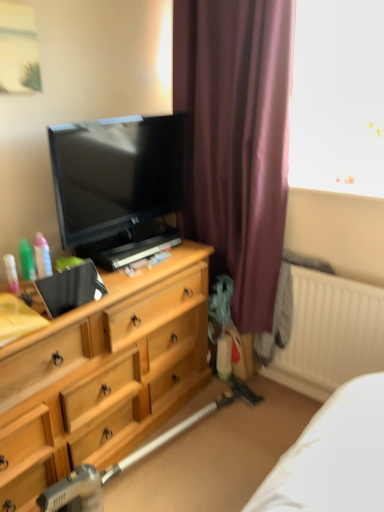
Identify the location of translucent plastic bottles at left, arranged as the 3th toiletry when viewed from the left. Image resolution: width=384 pixels, height=512 pixels. (42, 256).

You are a GUI agent. You are given a task and a screenshot of the screen. Output one action in this format:
    pyautogui.click(x=<x>, y=<y>)
    Task: Click on the matte black tv at left
    This screenshot has width=384, height=512.
    Given the screenshot: What is the action you would take?
    pyautogui.click(x=118, y=185)

Describe the element at coordinates (26, 260) in the screenshot. Image resolution: width=384 pixels, height=512 pixels. I see `translucent plastic bottles at left, which appears as the 2th toiletry when viewed from the left` at that location.

Find the location of a particular element. This screenshot has width=384, height=512. translucent plastic bottles at left, arranged as the 3th toiletry when viewed from the left is located at coordinates (42, 256).

Which of these two, white ribbed radiator at right or matte black tv at left, is smaller?

matte black tv at left is smaller.

In the scene shown: Which is nearer, (357, 341) or (87, 219)?

The point (87, 219) is closer to the camera.

Would you say white ribbed radiator at right is to the left or to the right of matte black tv at left in the picture?

Clearly, white ribbed radiator at right is on the right of matte black tv at left in the image.

How different are the orientations of white ribbed radiator at right and matte black tv at left in degrees?

89.1 degrees.

Looking at this image, which object is positioned more to the right, translucent plastic bottles at left, which appears as the 2th toiletry when viewed from the left, or matte black tv at left?

matte black tv at left.

Is translucent plastic bottles at left, positioned as the 2th toiletry in right-to-left order, aimed at matte black tv at left?

No, translucent plastic bottles at left, positioned as the 2th toiletry in right-to-left order, is not aimed at matte black tv at left.

Is translucent plastic bottles at left, positioned as the 2th toiletry in right-to-left order, beside matte black tv at left?

No.

From a real-world perspective, between translucent plastic bottles at left, positioned as the 2th toiletry in right-to-left order, and matte black tv at left, who is vertically lower?

From a 3D spatial view, translucent plastic bottles at left, positioned as the 2th toiletry in right-to-left order, is below.

Who is bigger, translucent plastic bottles at left, positioned as the 2th toiletry in right-to-left order, or translucent plastic spray bottle at left, the 3th toiletry when ordered from right to left?

translucent plastic bottles at left, positioned as the 2th toiletry in right-to-left order, is bigger.

Is translucent plastic bottles at left, positioned as the 2th toiletry in right-to-left order, shorter than translucent plastic spray bottle at left, the 3th toiletry when ordered from right to left?

In fact, translucent plastic bottles at left, positioned as the 2th toiletry in right-to-left order, may be taller than translucent plastic spray bottle at left, the 3th toiletry when ordered from right to left.

Does point (28, 247) come behind point (13, 273)?

No, (28, 247) is closer to viewer.

Would you consider translucent plastic bottles at left, which appears as the 2th toiletry when viewed from the left, to be distant from translucent plastic spray bottle at left, the 3th toiletry when ordered from right to left?

No, translucent plastic bottles at left, which appears as the 2th toiletry when viewed from the left, is not far away from translucent plastic spray bottle at left, the 3th toiletry when ordered from right to left.

From the image's perspective, does wooden chest of drawers at left appear higher than translucent plastic spray bottle at left, which is counted as the 1th toiletry, starting from the left?

No, from the image's perspective, wooden chest of drawers at left is not above translucent plastic spray bottle at left, which is counted as the 1th toiletry, starting from the left.

Which object is closer to the camera, wooden chest of drawers at left or translucent plastic spray bottle at left, the 3th toiletry when ordered from right to left?

wooden chest of drawers at left.

Is wooden chest of drawers at left next to translucent plastic spray bottle at left, which is counted as the 1th toiletry, starting from the left?

wooden chest of drawers at left and translucent plastic spray bottle at left, which is counted as the 1th toiletry, starting from the left, are not in contact.

Is wooden chest of drawers at left oriented towards translucent plastic spray bottle at left, the 3th toiletry when ordered from right to left?

No, wooden chest of drawers at left is not aimed at translucent plastic spray bottle at left, the 3th toiletry when ordered from right to left.

Is metallic silver vacuum cleaner at lower center bigger or smaller than purple fabric curtain at center?

Clearly, metallic silver vacuum cleaner at lower center is smaller in size than purple fabric curtain at center.

The width and height of the screenshot is (384, 512). Find the location of `equipment located underneath the purple fabric curtain at center (from a real-world perspective)`. equipment located underneath the purple fabric curtain at center (from a real-world perspective) is located at coordinates (129, 459).

Is metallic silver vacuum cleaner at lower center oriented towards purple fabric curtain at center?

No, metallic silver vacuum cleaner at lower center is not facing towards purple fabric curtain at center.

Looking at this image, which is in front, metallic silver vacuum cleaner at lower center or purple fabric curtain at center?

metallic silver vacuum cleaner at lower center is in front.

Is point (128, 150) positioned before point (43, 242)?

No, it is not.

How much distance is there between matte black tv at left and translucent plastic bottles at left, the first toiletry from the right?

They are 17.00 inches apart.

Based on the photo, from a real-world perspective, is matte black tv at left above or below translucent plastic bottles at left, arranged as the 3th toiletry when viewed from the left?

From a real-world perspective, matte black tv at left is physically above translucent plastic bottles at left, arranged as the 3th toiletry when viewed from the left.

Considering the relative positions of matte black tv at left and translucent plastic bottles at left, arranged as the 3th toiletry when viewed from the left, in the image provided, is matte black tv at left to the left or to the right of translucent plastic bottles at left, arranged as the 3th toiletry when viewed from the left,?

From the image, it's evident that matte black tv at left is to the right of translucent plastic bottles at left, arranged as the 3th toiletry when viewed from the left.

Find the location of a particular element. The image size is (384, 512). chest of drawers below the translucent plastic bottles at left, positioned as the 2th toiletry in right-to-left order (from a real-world perspective) is located at coordinates (103, 374).

Looking at the image, does translucent plastic bottles at left, positioned as the 2th toiletry in right-to-left order, seem bigger or smaller compared to wooden chest of drawers at left?

translucent plastic bottles at left, positioned as the 2th toiletry in right-to-left order, is smaller than wooden chest of drawers at left.

Is translucent plastic bottles at left, which appears as the 2th toiletry when viewed from the left, not inside wooden chest of drawers at left?

Absolutely, translucent plastic bottles at left, which appears as the 2th toiletry when viewed from the left, is external to wooden chest of drawers at left.

From a real-world perspective, is translucent plastic bottles at left, which appears as the 2th toiletry when viewed from the left, physically above wooden chest of drawers at left?

Yes, from a real-world perspective, translucent plastic bottles at left, which appears as the 2th toiletry when viewed from the left, is on top of wooden chest of drawers at left.

I want to click on radiator behind the matte black tv at left, so click(330, 334).

This screenshot has height=512, width=384. Find the location of `television in front of the translucent plastic bottles at left, positioned as the 2th toiletry in right-to-left order`. television in front of the translucent plastic bottles at left, positioned as the 2th toiletry in right-to-left order is located at coordinates (118, 185).

From the image, which object appears to be farther from translucent plastic spray bottle at left, the 3th toiletry when ordered from right to left, matte black tv at left or purple fabric curtain at center?

purple fabric curtain at center is positioned further to the anchor translucent plastic spray bottle at left, the 3th toiletry when ordered from right to left.

In the scene shown: Estimate the real-world distances between objects in this image. Which object is further from translucent plastic spray bottle at left, which is counted as the 1th toiletry, starting from the left, translucent plastic bottles at left, the first toiletry from the right, or metallic silver vacuum cleaner at lower center?

metallic silver vacuum cleaner at lower center is further to translucent plastic spray bottle at left, which is counted as the 1th toiletry, starting from the left.

Estimate the real-world distances between objects in this image. Which object is closer to metallic silver vacuum cleaner at lower center, white ribbed radiator at right or wooden chest of drawers at left?

wooden chest of drawers at left is closer to metallic silver vacuum cleaner at lower center.

From the image, which object appears to be farther from translucent plastic bottles at left, the first toiletry from the right, translucent plastic bottles at left, positioned as the 2th toiletry in right-to-left order, or wooden chest of drawers at left?

wooden chest of drawers at left lies further to translucent plastic bottles at left, the first toiletry from the right, than the other object.

Which object lies further to the anchor point wooden chest of drawers at left, white ribbed radiator at right or translucent plastic bottles at left, arranged as the 3th toiletry when viewed from the left?

white ribbed radiator at right is positioned further to the anchor wooden chest of drawers at left.

Considering their positions, is metallic silver vacuum cleaner at lower center positioned closer to white ribbed radiator at right than translucent plastic bottles at left, arranged as the 3th toiletry when viewed from the left?

Among the two, metallic silver vacuum cleaner at lower center is located nearer to white ribbed radiator at right.

Estimate the real-world distances between objects in this image. Which object is closer to white ribbed radiator at right, translucent plastic spray bottle at left, which is counted as the 1th toiletry, starting from the left, or wooden chest of drawers at left?

wooden chest of drawers at left is positioned closer to the anchor white ribbed radiator at right.

Based on their spatial positions, is purple fabric curtain at center or wooden chest of drawers at left further from white ribbed radiator at right?

wooden chest of drawers at left is further to white ribbed radiator at right.

You are a GUI agent. You are given a task and a screenshot of the screen. Output one action in this format:
    pyautogui.click(x=<x>, y=<y>)
    Task: Click on the equipment situated between translucent plastic bottles at left, positioned as the 2th toiletry in right-to-left order, and white ribbed radiator at right from left to right
    
    Given the screenshot: What is the action you would take?
    pyautogui.click(x=129, y=459)

At what (x,y) coordinates should I click in order to perform the action: click on toiletry located between translucent plastic bottles at left, positioned as the 2th toiletry in right-to-left order, and matte black tv at left in the left-right direction. Please return your answer as a coordinate pair (x, y). The image size is (384, 512). Looking at the image, I should click on (42, 256).

Locate an element on the screen. The height and width of the screenshot is (512, 384). the chest of drawers located between translucent plastic bottles at left, positioned as the 2th toiletry in right-to-left order, and white ribbed radiator at right in the left-right direction is located at coordinates (103, 374).

The width and height of the screenshot is (384, 512). I want to click on television located between wooden chest of drawers at left and white ribbed radiator at right in the left-right direction, so click(118, 185).